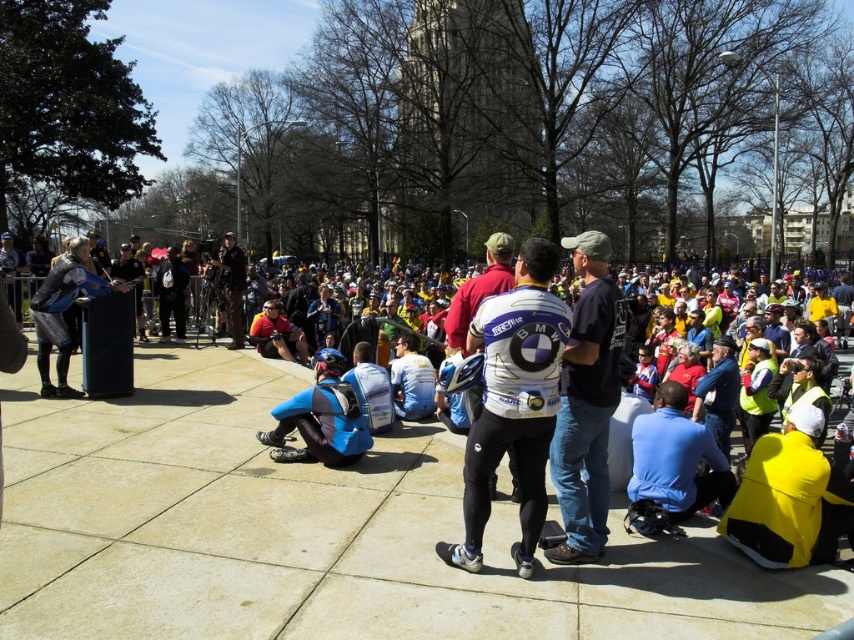
You are standing at the center of the plaza where the podium is located. You need to locate the blue fabric jacket at lower right. Which direction should you face to see it?

You should face towards the lower right direction to see the blue fabric jacket at lower right, as its 2D location is at point (676, 458), which corresponds to the lower right area of the image.

You are standing at the center of the plaza and see the point marked at coordinates point (790,497). What object is located at that point?

The point (790,497) corresponds to the yellow matte jacket at lower right.

You are standing at the center of the plaza and want to find the yellow matte jacket at lower right. Based on the coordinates provided, in which direction should you move to locate it?

The yellow matte jacket at lower right is located at coordinates point [790,497]. Since you are at the center, you should move towards the lower right direction to locate it.